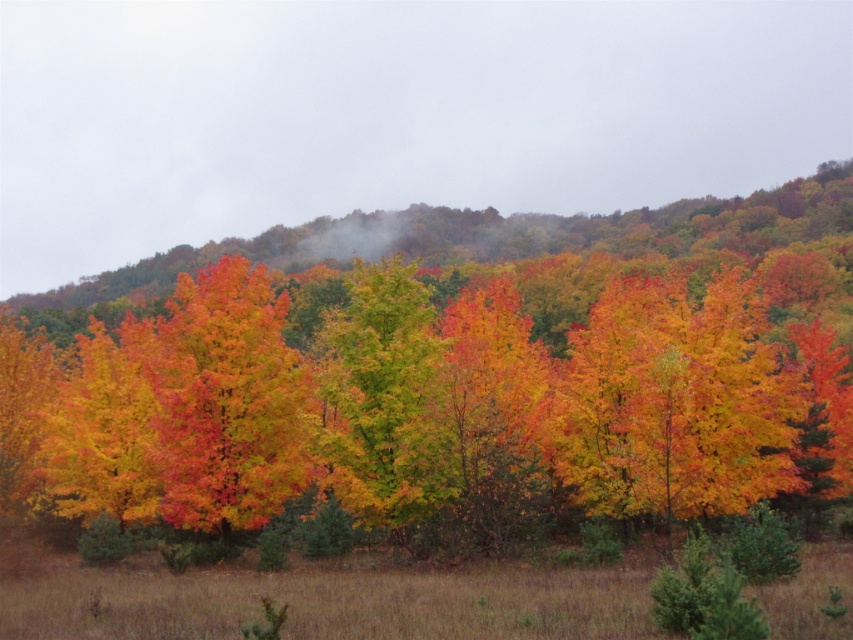
Question: Which point is closer to the camera?

Choices:
 (A) green matte tree at center
 (B) vivid orange leaves at center

Answer: (B)

Question: Is vivid orange leaves at center in front of green matte tree at center?

Choices:
 (A) yes
 (B) no

Answer: (A)

Question: Does shiny orange leaves at center appear under green matte tree at center?

Choices:
 (A) no
 (B) yes

Answer: (A)

Question: Which object is farther from the camera taking this photo?

Choices:
 (A) shiny orange leaves at center
 (B) vivid orange leaves at center

Answer: (A)

Question: Is vivid orange leaves at center further to the viewer compared to shiny orange leaves at center?

Choices:
 (A) no
 (B) yes

Answer: (A)

Question: Which of these objects is positioned closest to the green matte tree at center?

Choices:
 (A) shiny orange leaves at center
 (B) vivid orange leaves at center

Answer: (A)